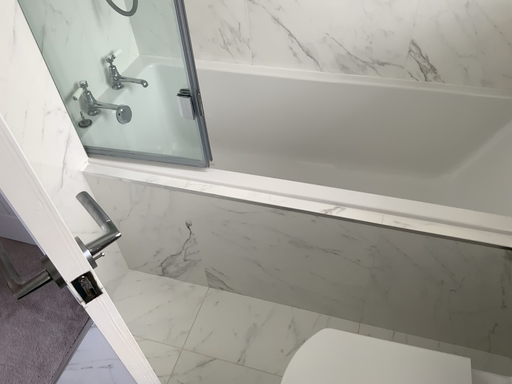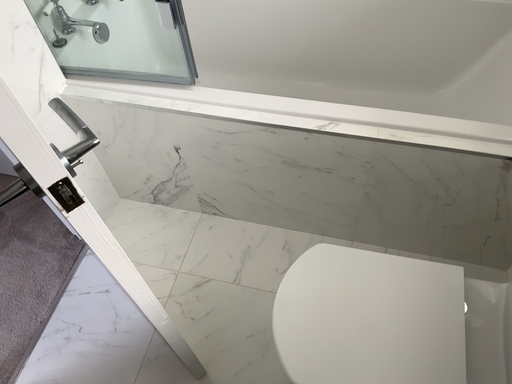
Question: Which way did the camera rotate in the video?

Choices:
 (A) rotated upward
 (B) rotated downward

Answer: (B)